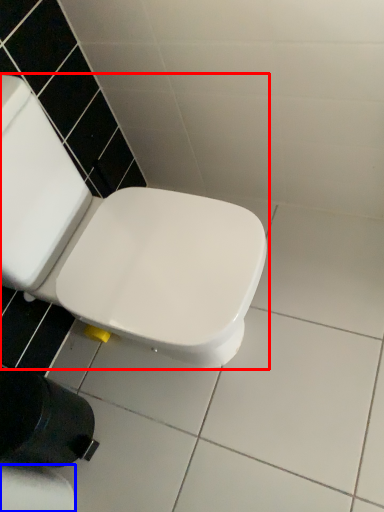
Question: Among these objects, which one is farthest to the camera, toilet (highlighted by a red box) or toilet paper (highlighted by a blue box)?

Choices:
 (A) toilet
 (B) toilet paper

Answer: (B)